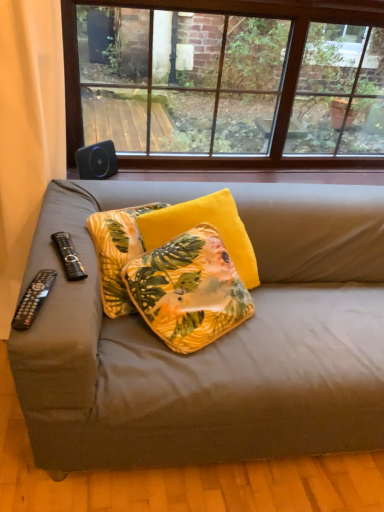
Question: Is point (33, 68) closer or farther from the camera than point (172, 330)?

Choices:
 (A) closer
 (B) farther

Answer: (B)

Question: Considering the positions of black fabric remote at left and yellow floral pillow at center, positioned as the 2th pillow in right-to-left order, in the image, is black fabric remote at left taller or shorter than yellow floral pillow at center, positioned as the 2th pillow in right-to-left order,?

Choices:
 (A) tall
 (B) short

Answer: (A)

Question: Which of these objects is positioned closest to the brown wooden window at upper center?

Choices:
 (A) yellow floral pillow at center, the 2th pillow in the left-to-right sequence
 (B) black plastic remote at lower left, the 1th remote control when ordered from bottom to top
 (C) black fabric remote at left
 (D) black plastic remote at left, which is the first remote control in back-to-front order
 (E) yellow velvet pillow at center, positioned as the 1th pillow in left-to-right order

Answer: (C)

Question: Which is nearer to the yellow velvet pillow at center, the 1th pillow when ordered from right to left?

Choices:
 (A) yellow floral pillow at center, the 2th pillow in the left-to-right sequence
 (B) yellow velvet pillow at center, the third pillow from the right
 (C) matte gray couch at center
 (D) black fabric remote at left
 (E) black plastic remote at lower left, which is counted as the 2th remote control, starting from the top

Answer: (A)